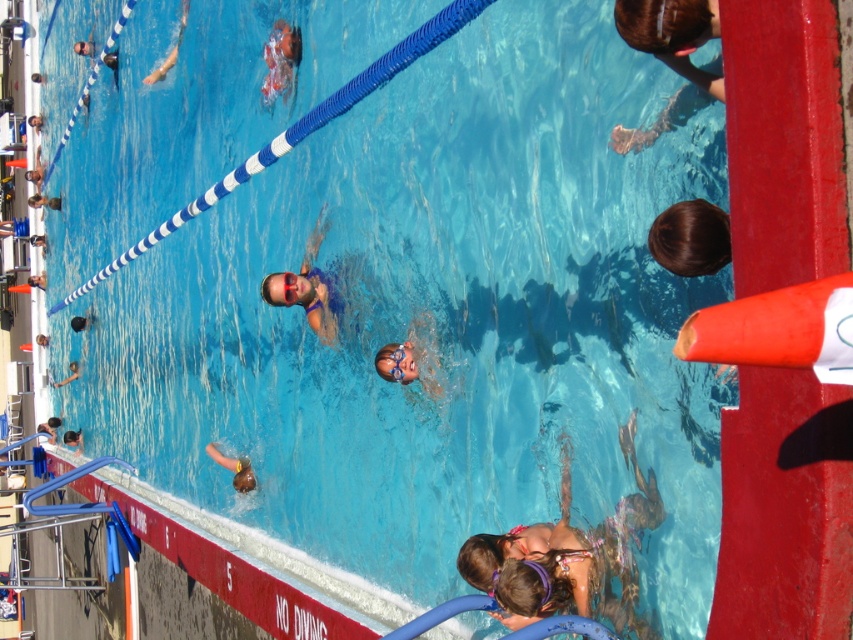
You are a swim instructor standing at the poolside. You need to quickly reach either the light pink fabric bikini at lower center or the smooth skin face at upper center to assist a swimmer. Which one is closer to you based on their positions?

The smooth skin face at upper center is closer to you because it is only 7.03 meters away from the light pink fabric bikini at lower center, so whichever is closer depends on your position. However, since the question states you are at the poolside, and the bikini is at lower center while the face is at upper center, typically the upper center would be closer to the poolside. Therefore, the smooth skin face at upper center is closer.

Consider the image. You are standing at the edge of the pool and see the light pink fabric bikini at lower center. Which direction should you look to find the point marked at coordinates (567, 556)?

The point marked at coordinates (567, 556) corresponds to the light pink fabric bikini at lower center, so you should look downward toward the lower center area of the pool.